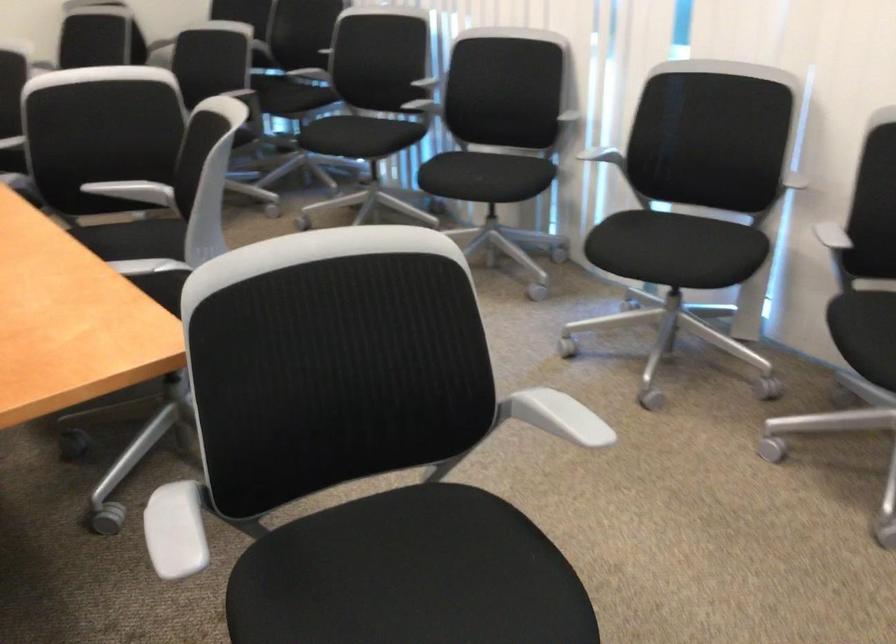
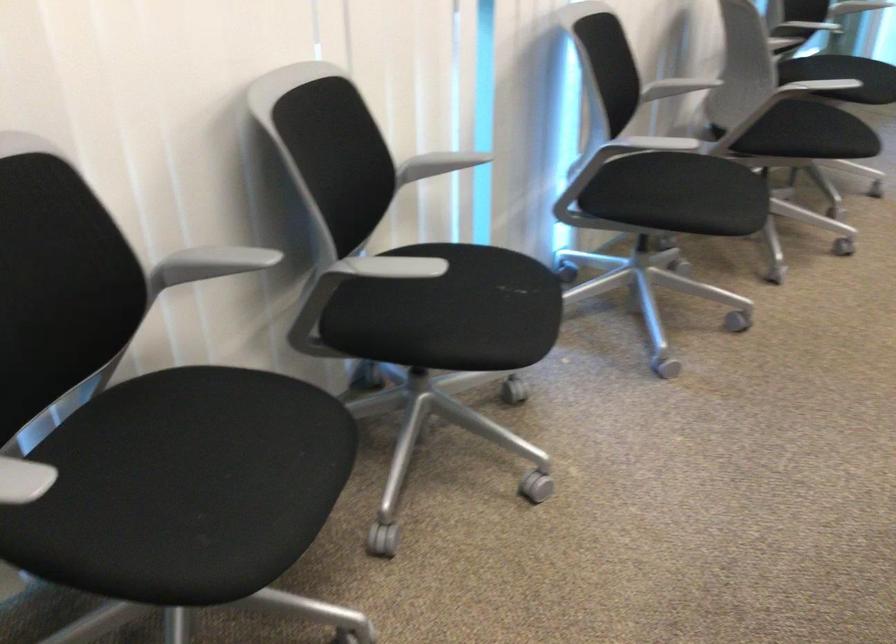
Locate, in the second image, the point that corresponds to the point at 357,134 in the first image.

(226, 456)